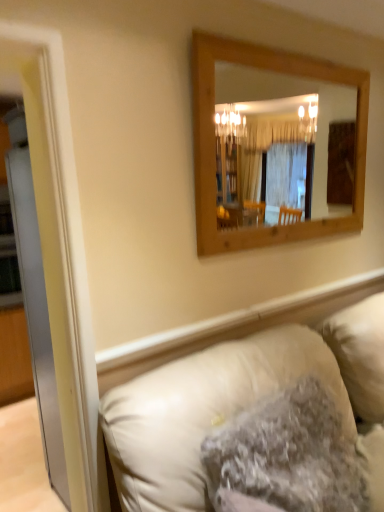
Question: From a real-world perspective, is wooden mirror at upper center located higher than fuzzy beige pillow at lower center?

Choices:
 (A) no
 (B) yes

Answer: (B)

Question: Does wooden mirror at upper center have a smaller size compared to fuzzy beige pillow at lower center?

Choices:
 (A) no
 (B) yes

Answer: (B)

Question: Does wooden mirror at upper center appear on the right side of fuzzy beige pillow at lower center?

Choices:
 (A) yes
 (B) no

Answer: (A)

Question: Would you say wooden mirror at upper center is a long distance from fuzzy beige pillow at lower center?

Choices:
 (A) no
 (B) yes

Answer: (B)

Question: Is wooden mirror at upper center placed right next to fuzzy beige pillow at lower center?

Choices:
 (A) no
 (B) yes

Answer: (A)

Question: Relative to fuzzy beige pillow at lower center, is wooden mirror at upper center in front or behind?

Choices:
 (A) behind
 (B) front

Answer: (A)

Question: Based on their sizes in the image, would you say wooden mirror at upper center is bigger or smaller than fuzzy beige pillow at lower center?

Choices:
 (A) big
 (B) small

Answer: (B)

Question: Do you think wooden mirror at upper center is within fuzzy beige pillow at lower center, or outside of it?

Choices:
 (A) inside
 (B) outside

Answer: (B)

Question: In terms of height, does wooden mirror at upper center look taller or shorter compared to fuzzy beige pillow at lower center?

Choices:
 (A) short
 (B) tall

Answer: (B)

Question: Considering the relative positions of fuzzy beige pillow at lower center and wooden mirror at upper center in the image provided, is fuzzy beige pillow at lower center to the left or to the right of wooden mirror at upper center?

Choices:
 (A) right
 (B) left

Answer: (B)

Question: Looking at the image, does fuzzy beige pillow at lower center seem bigger or smaller compared to wooden mirror at upper center?

Choices:
 (A) small
 (B) big

Answer: (B)

Question: In the image, is fuzzy beige pillow at lower center positioned in front of or behind wooden mirror at upper center?

Choices:
 (A) behind
 (B) front

Answer: (B)

Question: Does point (291, 431) appear closer or farther from the camera than point (314, 175)?

Choices:
 (A) farther
 (B) closer

Answer: (B)

Question: From their relative heights in the image, would you say wooden mirror at upper center is taller or shorter than leather couch at lower right?

Choices:
 (A) short
 (B) tall

Answer: (A)

Question: Considering the relative positions of wooden mirror at upper center and leather couch at lower right in the image provided, is wooden mirror at upper center to the left or to the right of leather couch at lower right?

Choices:
 (A) right
 (B) left

Answer: (A)